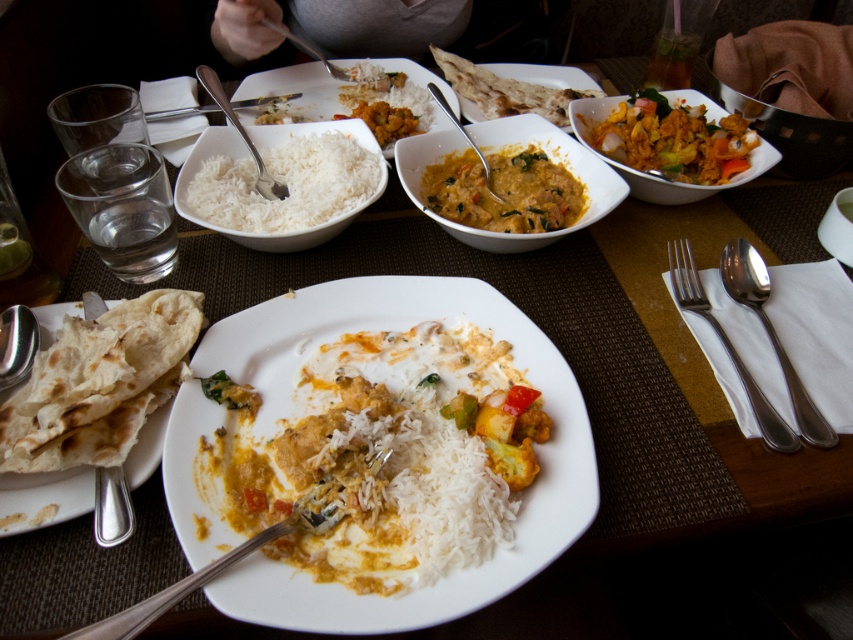
Question: Can you confirm if brown soft flatbread at lower left is positioned to the left of silvermetallicspoon at right?

Choices:
 (A) no
 (B) yes

Answer: (B)

Question: Which object appears closest to the camera in this image?

Choices:
 (A) matte yellow curry at center
 (B) silvermetallicspoon at right
 (C) yellowish creamy curry at center

Answer: (B)

Question: Based on their relative distances, which object is nearer to the rich yellow curry with vegetables at upper right?

Choices:
 (A) matte ceramic curry at center
 (B) silvermetallicfork/spoon at right

Answer: (A)

Question: In this image, where is rich yellow curry with vegetables at upper right located relative to matte yellow curry at center?

Choices:
 (A) below
 (B) above

Answer: (A)

Question: Is yellow creamy curry with vegetables at center positioned behind brown soft flatbread at lower left?

Choices:
 (A) no
 (B) yes

Answer: (A)

Question: Which of these objects is positioned farthest from the yellowish creamy curry at center?

Choices:
 (A) satin silver spoon at center
 (B) yellow creamy curry with vegetables at center
 (C) matte yellow curry at center
 (D) silver metallic spoon at left

Answer: (D)